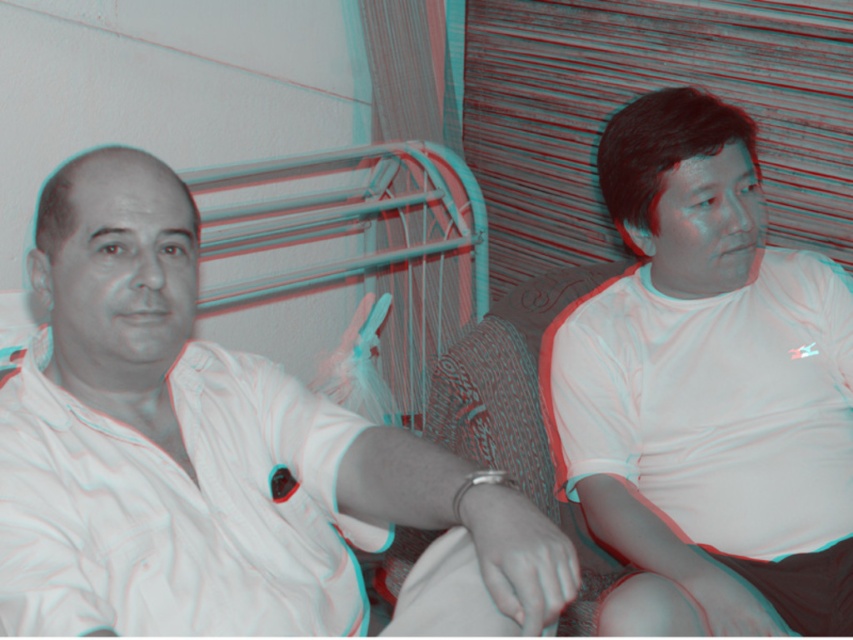
You are designing a clothing catalog and need to compare the two white shirts in the image. Which shirt has a wider silhouette between the white matte shirt at left and the white cotton shirt at right?

The white matte shirt at left has a wider silhouette than the white cotton shirt at right according to the description provided.